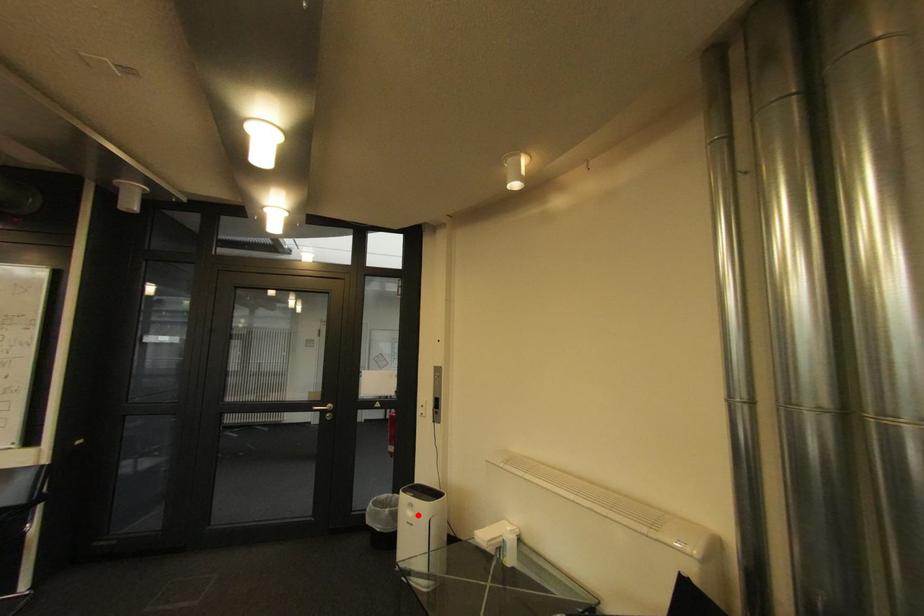
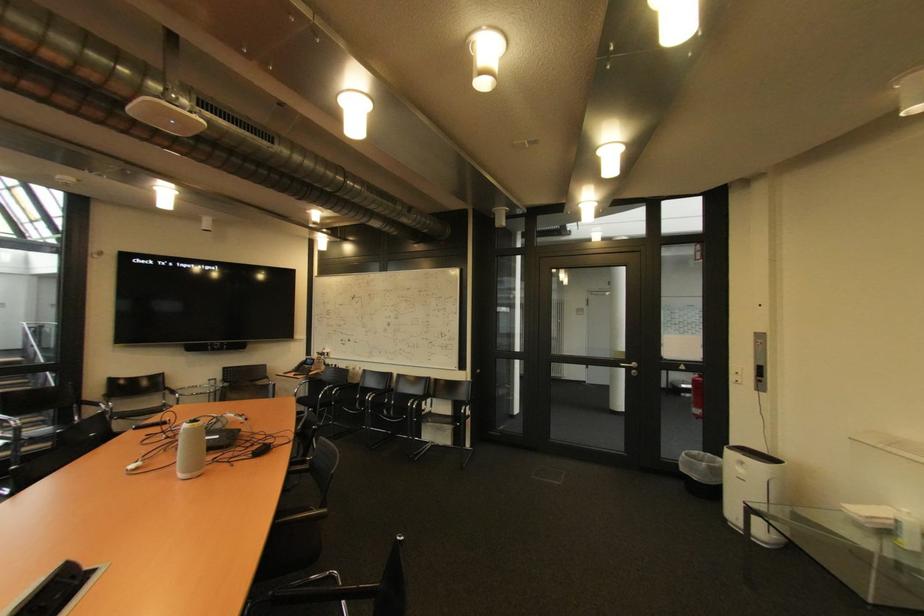
Find the pixel in the second image that matches the highlighted location in the first image.

(748, 471)